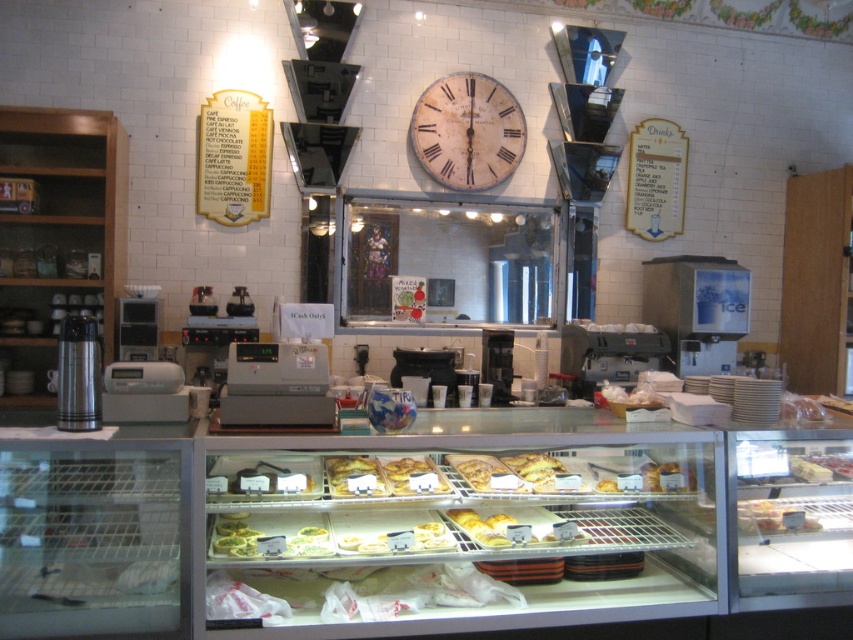
Based on the photo, you are a customer in the bakery and want to grab both the golden brown flaky pastry at center and the golden brown pastry at center. However, the display case is only 3 inches wide. Can you fit both pastries side by side in the display case?

The golden brown flaky pastry at center is 3.75 inches from the golden brown pastry at center, which means the combined width of both pastries is 3.75 inches. Since the display case is only 3 inches wide, they cannot fit side by side.

You are standing in the bakery and want to take a photo of the two points mentioned. Which point, point [368,481] or point [402,483], will appear larger in your photo?

Point [368,481] will appear larger in the photo because it is closer to the camera than point [402,483].